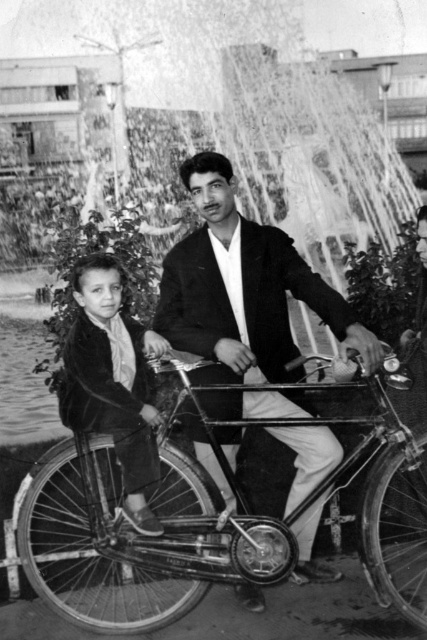
In the scene shown: You are standing in the public square and want to take a photo of the smooth black jacket at center. Where should you position yourself to capture it in the frame?

The smooth black jacket at center is located at coordinates 0.452 on the x axis and 0.569 on the y axis, so you should position yourself directly facing that point to capture it in the frame.

You are standing in the public square and want to take a photo of the metallic silver bicycle at center. The fountain is in the background. Where should you position yourself relative to the fountain to ensure the bicycle is in the frame?

Since the metallic silver bicycle at center is located at point (139, 534), you should position yourself near the fountain and aim towards the coordinates to capture the bicycle in the frame.

You are a delivery person who needs to carry a package that is 2 meters wide. You see the metallic silver bicycle at center and the velvet jacket at center in the image. Can you determine if the bicycle is wide enough to place the package on top of it?

Result: The metallic silver bicycle at center might be wider than velvet jacket at center, so it is possible that the bicycle could accommodate the 2 meter wide package, but there is uncertainty due to the comparison only being relative to the jacket.